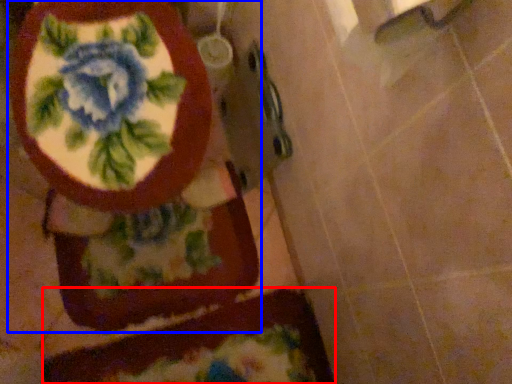
Question: Which of the following is the farthest to the observer, bath mat (highlighted by a red box) or toilet (highlighted by a blue box)?

Choices:
 (A) bath mat
 (B) toilet

Answer: (A)